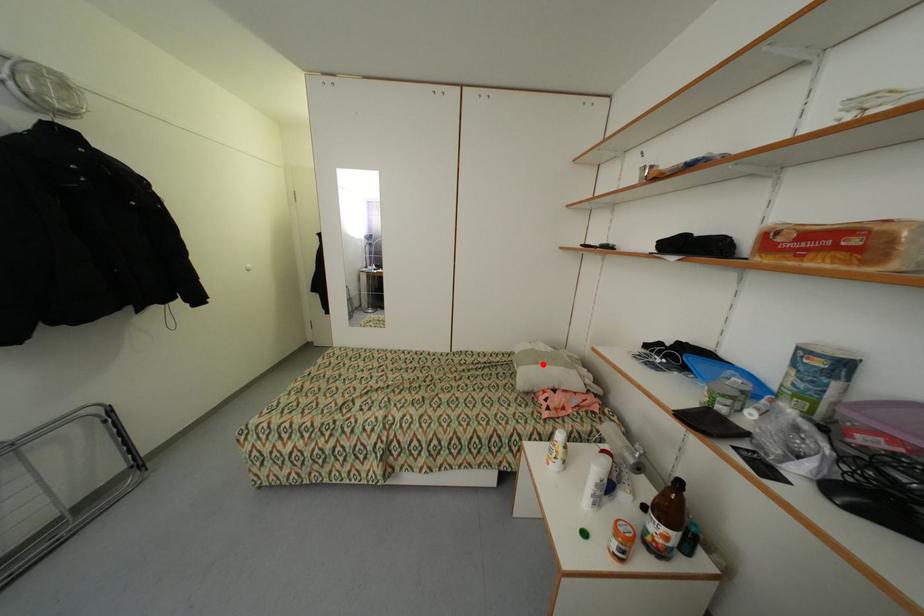
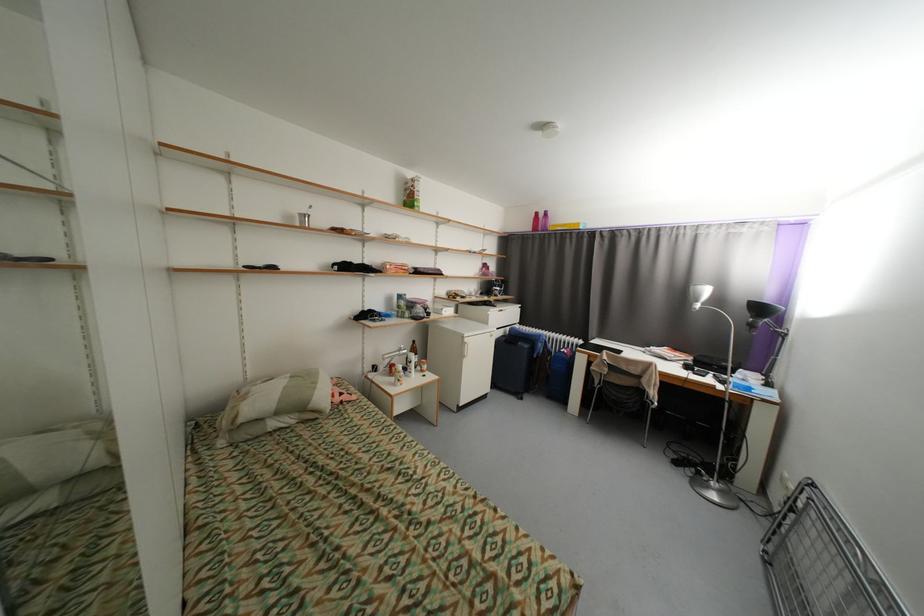
Question: I am providing you with two images of the same scene from different viewpoints. Given a red point in image1, look at the same physical point in image2. Is it:

Choices:
 (A) Closer to the viewpoint
 (B) Farther from the viewpoint

Answer: (A)